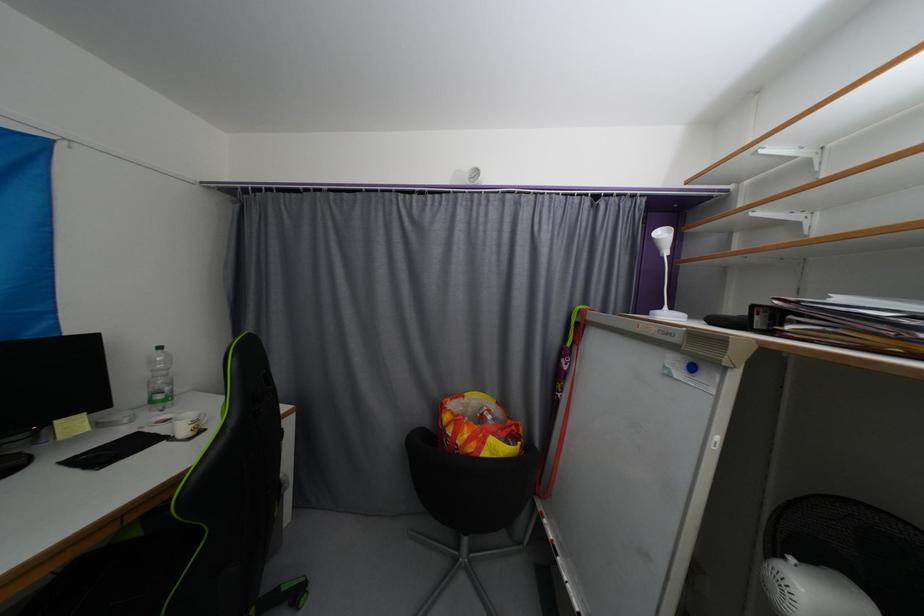
This screenshot has height=616, width=924. Identify the location of white coffee mug handle. (202, 419).